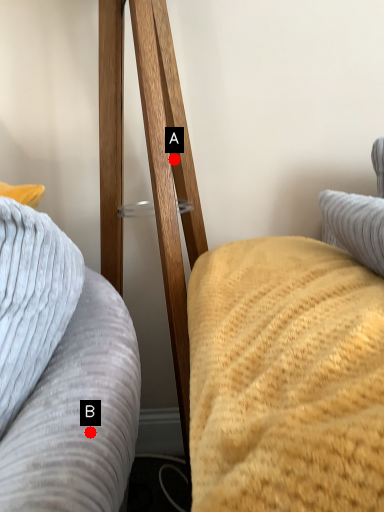
Question: Two points are circled on the image, labeled by A and B beside each circle. Which point is farther to the camera?

Choices:
 (A) A is further
 (B) B is further

Answer: (A)